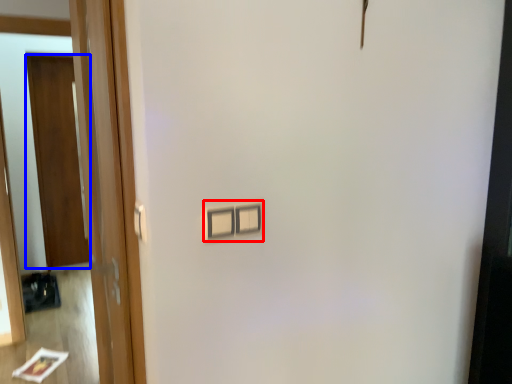
Question: Which point is closer to the camera, light switch (highlighted by a red box) or door (highlighted by a blue box)?

Choices:
 (A) light switch
 (B) door

Answer: (A)